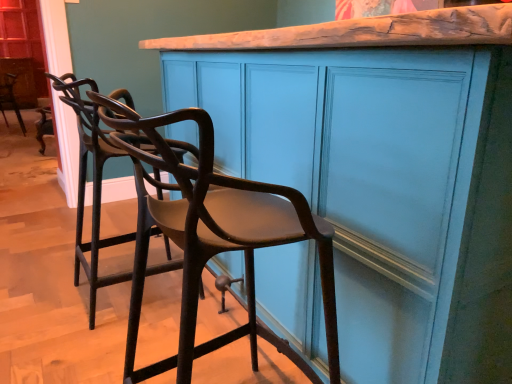
Question: Does matte teal cabinet at center come behind brown wood chair at center, positioned as the 3th chair in back-to-front order?

Choices:
 (A) no
 (B) yes

Answer: (B)

Question: From a real-world perspective, is matte teal cabinet at center under brown wood chair at center, arranged as the first chair when viewed from the right?

Choices:
 (A) yes
 (B) no

Answer: (B)

Question: Considering the relative positions of matte teal cabinet at center and brown wood chair at center, positioned as the 3th chair in left-to-right order, in the image provided, is matte teal cabinet at center to the left of brown wood chair at center, positioned as the 3th chair in left-to-right order, from the viewer's perspective?

Choices:
 (A) no
 (B) yes

Answer: (A)

Question: From a real-world perspective, is matte teal cabinet at center positioned over brown wood chair at center, positioned as the 3th chair in back-to-front order, based on gravity?

Choices:
 (A) no
 (B) yes

Answer: (B)

Question: Is matte teal cabinet at center wider than brown wood chair at center, positioned as the 3th chair in back-to-front order?

Choices:
 (A) no
 (B) yes

Answer: (B)

Question: Considering the positions of matte black chair at left, placed as the second chair when sorted from right to left, and metallic dark brown chair at left, which appears as the third chair when viewed from the front, in the image, is matte black chair at left, placed as the second chair when sorted from right to left, wider or thinner than metallic dark brown chair at left, which appears as the third chair when viewed from the front,?

Choices:
 (A) thin
 (B) wide

Answer: (B)

Question: Choose the correct answer: Is matte black chair at left, arranged as the second chair when viewed from the front, inside metallic dark brown chair at left, which is the 1th chair from back to front, or outside it?

Choices:
 (A) inside
 (B) outside

Answer: (B)

Question: Is point (71, 96) closer or farther from the camera than point (22, 127)?

Choices:
 (A) closer
 (B) farther

Answer: (A)

Question: Considering the positions of matte black chair at left, arranged as the second chair when viewed from the front, and metallic dark brown chair at left, which is the 1th chair from back to front, in the image, is matte black chair at left, arranged as the second chair when viewed from the front, taller or shorter than metallic dark brown chair at left, which is the 1th chair from back to front,?

Choices:
 (A) tall
 (B) short

Answer: (A)

Question: Is metallic dark brown chair at left, marked as the 1th chair in a left-to-right arrangement, in front of or behind brown wood chair at center, positioned as the 3th chair in left-to-right order, in the image?

Choices:
 (A) front
 (B) behind

Answer: (B)

Question: Considering the relative positions of metallic dark brown chair at left, marked as the 1th chair in a left-to-right arrangement, and brown wood chair at center, positioned as the 3th chair in left-to-right order, in the image provided, is metallic dark brown chair at left, marked as the 1th chair in a left-to-right arrangement, to the left or to the right of brown wood chair at center, positioned as the 3th chair in left-to-right order,?

Choices:
 (A) right
 (B) left

Answer: (B)

Question: From the image's perspective, is metallic dark brown chair at left, which is the 1th chair from back to front, located above or below brown wood chair at center, positioned as the 3th chair in left-to-right order?

Choices:
 (A) above
 (B) below

Answer: (A)

Question: From their relative heights in the image, would you say metallic dark brown chair at left, which appears as the third chair when viewed from the front, is taller or shorter than brown wood chair at center, positioned as the 3th chair in back-to-front order?

Choices:
 (A) short
 (B) tall

Answer: (A)

Question: In terms of width, does brown wood chair at center, arranged as the first chair when viewed from the front, look wider or thinner when compared to matte black chair at left, arranged as the second chair when viewed from the front?

Choices:
 (A) wide
 (B) thin

Answer: (A)

Question: From the image's perspective, relative to matte black chair at left, arranged as the second chair when viewed from the front, is brown wood chair at center, positioned as the 3th chair in left-to-right order, above or below?

Choices:
 (A) above
 (B) below

Answer: (B)